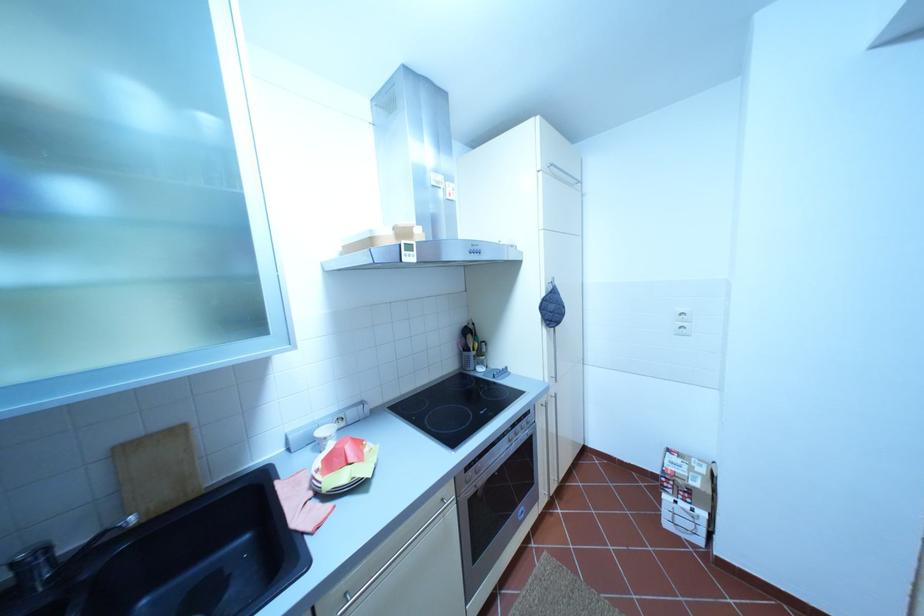
Find the location of `the left oven control knob`. the left oven control knob is located at coordinates (468, 471).